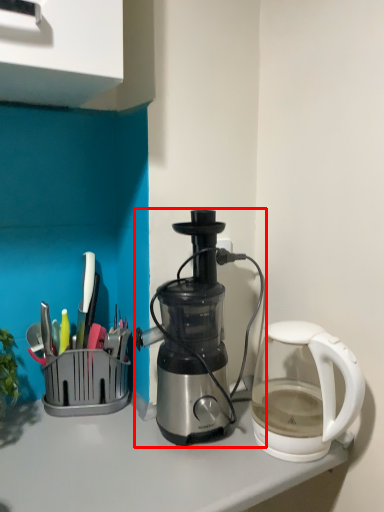
Question: Observing the image, what is the correct spatial positioning of coffee maker (annotated by the red box) in reference to kettle?

Choices:
 (A) left
 (B) right

Answer: (A)